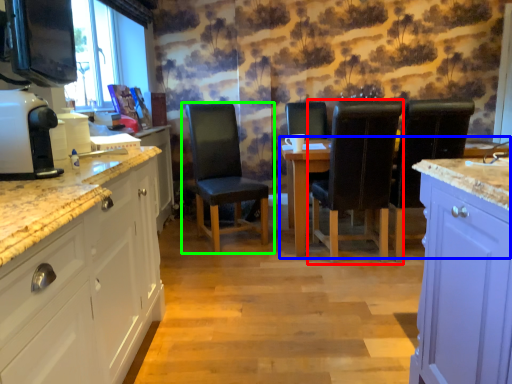
Question: Which is farther away from chair (highlighted by a red box)? kitchen & dining room table (highlighted by a blue box) or chair (highlighted by a green box)?

Choices:
 (A) kitchen & dining room table
 (B) chair

Answer: (B)